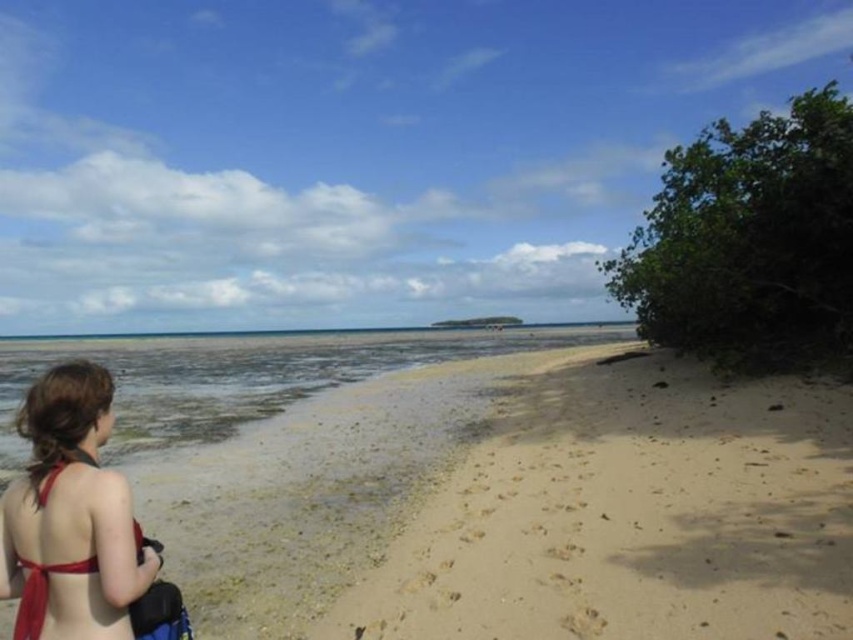
Question: Among these points, which one is farthest from the camera?

Choices:
 (A) (122, 595)
 (B) (676, 371)
 (C) (164, 420)

Answer: (B)

Question: Is clear water at lower left positioned in front of red bikini at lower left?

Choices:
 (A) yes
 (B) no

Answer: (B)

Question: Which object is positioned closest to the red bikini at lower left?

Choices:
 (A) light tan sand at center
 (B) clear water at lower left

Answer: (A)

Question: In this image, where is light tan sand at center located relative to clear water at lower left?

Choices:
 (A) right
 (B) left

Answer: (A)

Question: Does light tan sand at center appear on the left side of clear water at lower left?

Choices:
 (A) no
 (B) yes

Answer: (A)

Question: Estimate the real-world distances between objects in this image. Which object is farther from the light tan sand at center?

Choices:
 (A) clear water at lower left
 (B) red bikini at lower left

Answer: (A)